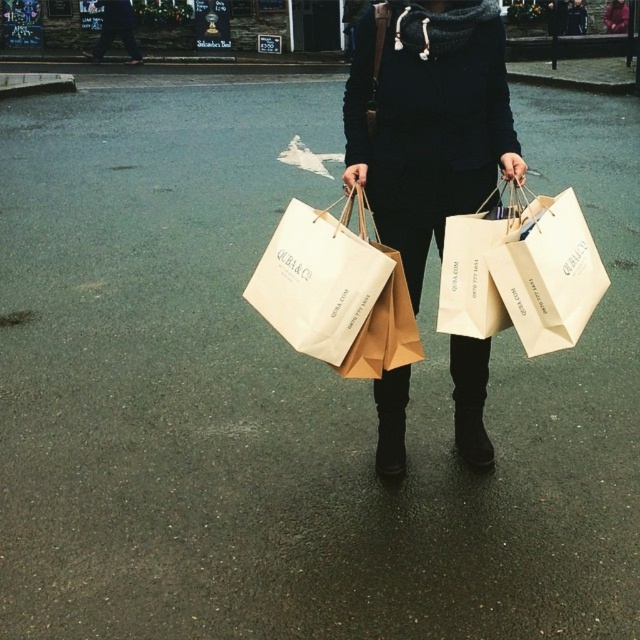
Question: Where is white paper bag at center located in relation to black suede boot at center in the image?

Choices:
 (A) above
 (B) below

Answer: (A)

Question: Which object appears closest to the camera in this image?

Choices:
 (A) matte paper shopping bags at center
 (B) white paper bag at center

Answer: (B)

Question: Which object is the closest to the matte paper shopping bags at center?

Choices:
 (A) black suede boot at center
 (B) matte white paper bag at center

Answer: (B)

Question: Estimate the real-world distances between objects in this image. Which object is farther from the white paper bag at center?

Choices:
 (A) matte white paper bag at center
 (B) matte paper shopping bags at center

Answer: (A)

Question: Can you confirm if matte white paper bag at center is positioned to the left of black suede boot at center?

Choices:
 (A) yes
 (B) no

Answer: (A)

Question: Where is matte paper shopping bags at center located in relation to black suede boot at center in the image?

Choices:
 (A) below
 (B) above

Answer: (B)